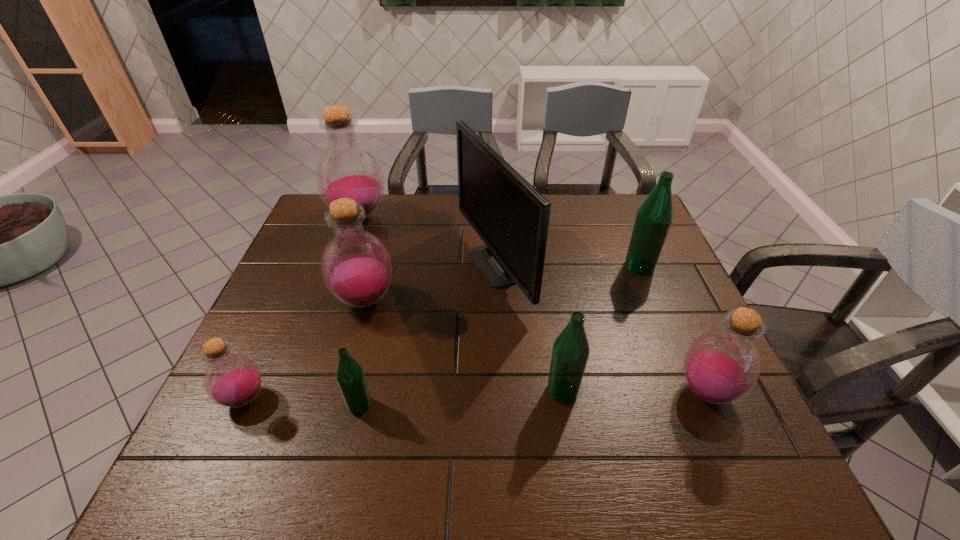
At what (x,y) coordinates should I click in order to perform the action: click on free spot located on the right of the leftmost green bottle. Please return your answer as a coordinate pair (x, y). Looking at the image, I should click on (489, 404).

The image size is (960, 540). Identify the location of free spot located on the back of the smallest purple bottle. (289, 300).

I want to click on bottle positioned at the far edge, so click(346, 168).

At what (x,y) coordinates should I click in order to perform the action: click on computer monitor positioned at the far edge. Please return your answer as a coordinate pair (x, y). The height and width of the screenshot is (540, 960). Looking at the image, I should click on (512, 218).

At what (x,y) coordinates should I click in order to perform the action: click on object located at the far left corner. Please return your answer as a coordinate pair (x, y). This screenshot has height=540, width=960. Looking at the image, I should click on (346, 168).

Identify the location of vacant space at the far edge. This screenshot has height=540, width=960. (576, 194).

In the image, there is a desktop. Where is `free space at the near edge`? free space at the near edge is located at coordinates (297, 448).

Locate an element on the screen. The image size is (960, 540). vacant region at the left edge of the desktop is located at coordinates (255, 427).

Where is `vacant space at the right edge of the desktop`? The image size is (960, 540). vacant space at the right edge of the desktop is located at coordinates (641, 280).

Where is `free space at the far right corner of the desktop`? free space at the far right corner of the desktop is located at coordinates (605, 226).